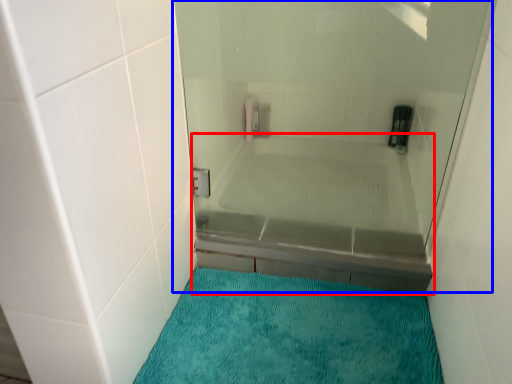
Question: Which of the following is the closest to the observer, bathtub (highlighted by a red box) or shower door (highlighted by a blue box)?

Choices:
 (A) bathtub
 (B) shower door

Answer: (B)